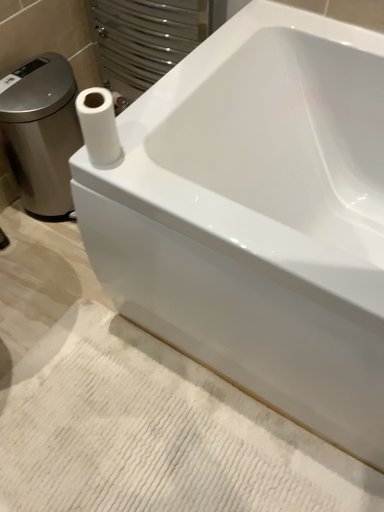
Question: Do you think white glossy porcelain at left is within white textured bath mat at lower center, or outside of it?

Choices:
 (A) outside
 (B) inside

Answer: (A)

Question: Is white glossy porcelain at left bigger or smaller than white textured bath mat at lower center?

Choices:
 (A) small
 (B) big

Answer: (B)

Question: Which object is positioned closest to the white matte paper towel at upper left?

Choices:
 (A) white textured bath mat at lower center
 (B) white glossy porcelain at left

Answer: (B)

Question: Which object is the closest to the white textured bath mat at lower center?

Choices:
 (A) white glossy porcelain at left
 (B) white matte paper towel at upper left

Answer: (B)